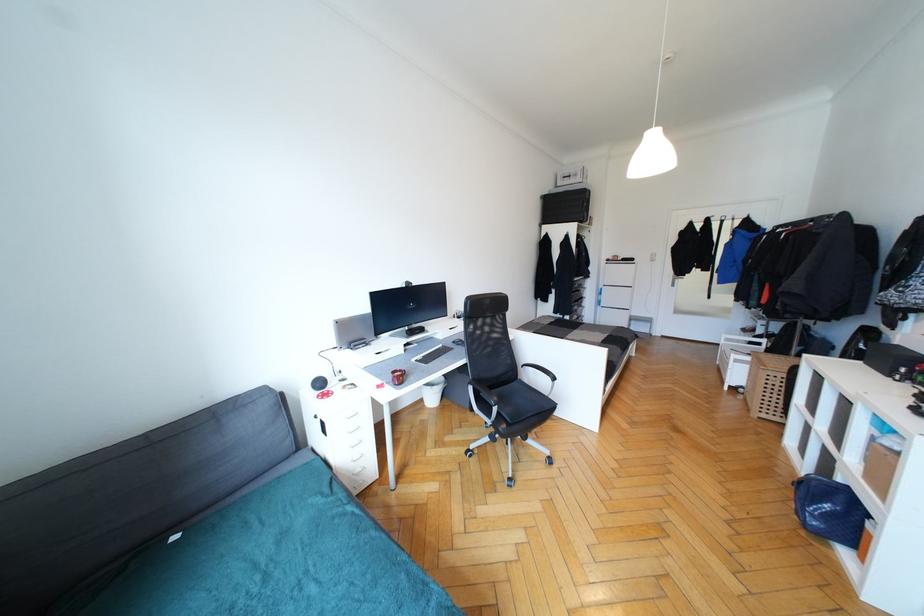
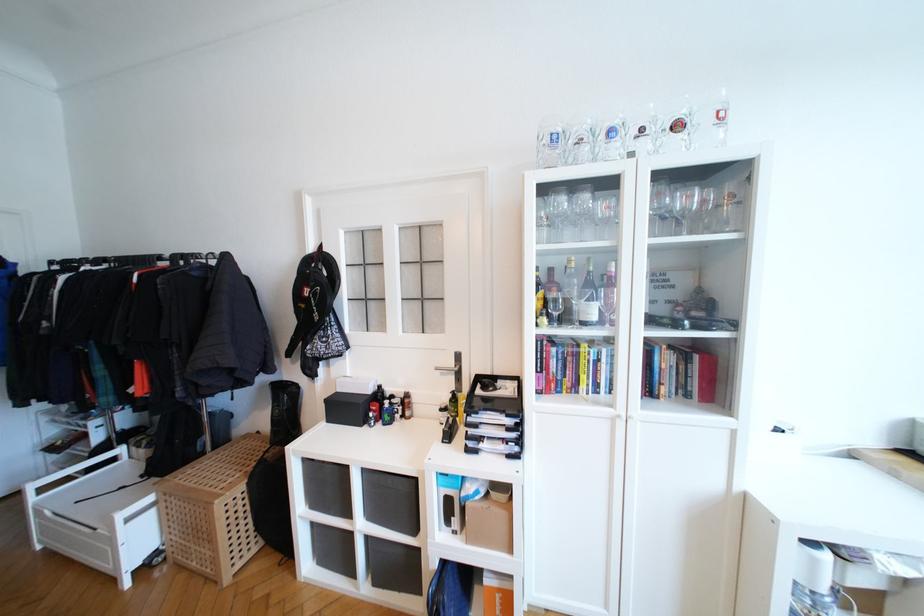
In the second image, find the point that corresponds to point 761,345 in the first image.

(116, 461)